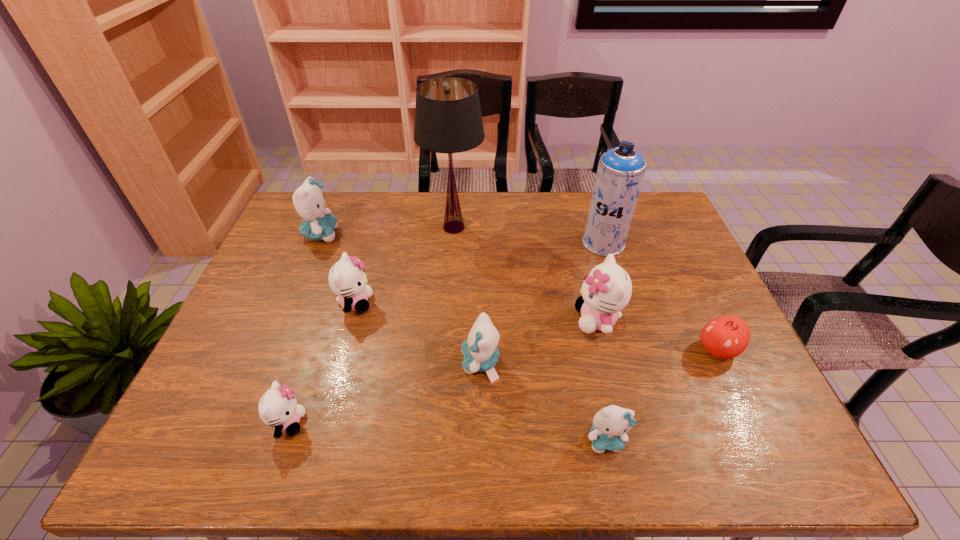
Identify the location of unoccupied area between the nearest white kitten and the tallest object. This screenshot has width=960, height=540. (372, 325).

Where is `free space between the second blue kitten from right to left and the lampshade`? This screenshot has height=540, width=960. free space between the second blue kitten from right to left and the lampshade is located at coordinates (468, 295).

I want to click on empty space between the rightmost object and the aerosol can, so click(x=660, y=296).

Where is `free space between the aerosol can and the second biggest blue kitten`? Image resolution: width=960 pixels, height=540 pixels. free space between the aerosol can and the second biggest blue kitten is located at coordinates (541, 303).

Where is `free space that is in between the biggest white kitten and the red apple`? The height and width of the screenshot is (540, 960). free space that is in between the biggest white kitten and the red apple is located at coordinates (657, 335).

Choose which object is the eighth nearest neighbor to the fourth kitten from left to right. Please provide its 2D coordinates. Your answer should be formatted as a tuple, i.e. [(x, y)], where the tuple contains the x and y coordinates of a point satisfying the conditions above.

[(309, 202)]

Locate an element on the screen. The image size is (960, 540). the fifth closest object relative to the second smallest white kitten is located at coordinates (607, 289).

Choose which kitten is the third nearest neighbor to the tallest object. Please provide its 2D coordinates. Your answer should be formatted as a tuple, i.e. [(x, y)], where the tuple contains the x and y coordinates of a point satisfying the conditions above.

[(607, 289)]

Locate which kitten is the second closest to the rightmost white kitten. Please provide its 2D coordinates. Your answer should be formatted as a tuple, i.e. [(x, y)], where the tuple contains the x and y coordinates of a point satisfying the conditions above.

[(610, 425)]

Identify which blue kitten is the second closest to the second biggest blue kitten. Please provide its 2D coordinates. Your answer should be formatted as a tuple, i.e. [(x, y)], where the tuple contains the x and y coordinates of a point satisfying the conditions above.

[(309, 202)]